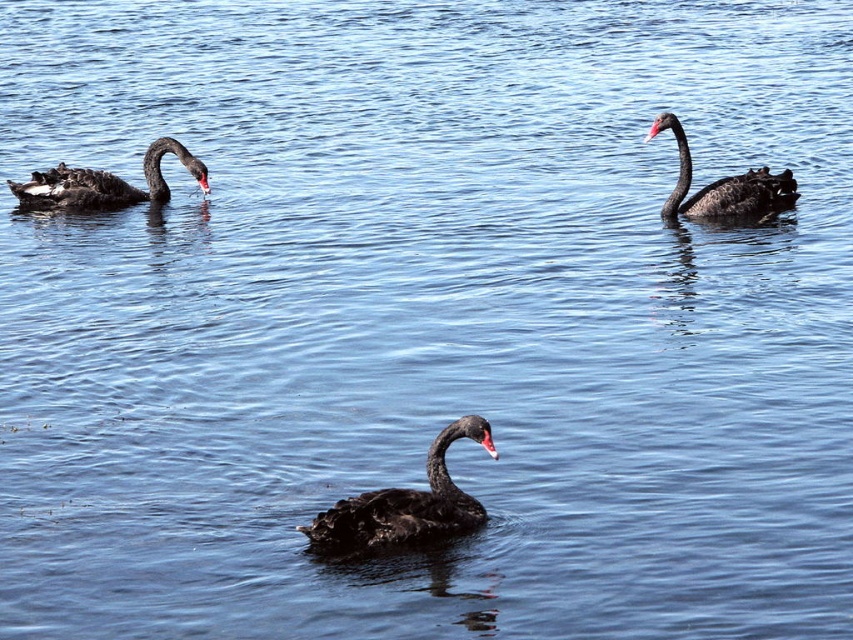
You are observing three black swans in a serene pond. You notice a matte black swan at center and a matte black swan at upper right. Which of these two swans is positioned more to the left in the image?

The matte black swan at center is positioned to the left of the matte black swan at upper right, so it is more to the left.

You are a photographer trying to capture a shot of the matte black swan at center and the matte black swan at upper right. Which swan would have its reflection more visible in the water?

The matte black swan at center would have its reflection more visible in the water because it is positioned under the matte black swan at upper right, meaning it is closer to the water surface where reflections are clearer.

You are a photographer trying to capture the matte black swan at left and the matte black swan at center in a single shot. Which swan will appear larger in your photo?

The matte black swan at center will appear larger in the photo because it is closer to the viewer than the matte black swan at left.